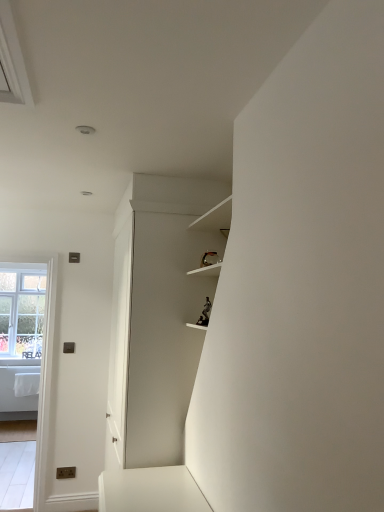
This screenshot has height=512, width=384. I want to click on clear glass window at left, so click(22, 310).

Considering the positions of objects white matte cabinet at center and clear glass window at left in the image provided, who is more to the right, white matte cabinet at center or clear glass window at left?

white matte cabinet at center.

From the image's perspective, is white matte cabinet at center positioned above or below clear glass window at left?

Based on their image positions, white matte cabinet at center is located above clear glass window at left.

Is white matte cabinet at center taller or shorter than clear glass window at left?

Considering their sizes, white matte cabinet at center has more height than clear glass window at left.

Between white matte cabinet at center and clear glass window at left, which one is positioned in front?

white matte cabinet at center.

Where is `glass door that is in front of the clear glass window at left`? The height and width of the screenshot is (512, 384). glass door that is in front of the clear glass window at left is located at coordinates (43, 370).

How many degrees apart are the facing directions of clear glass window at left and clear glass window at left?

The facing directions of clear glass window at left and clear glass window at left are 0.166 degrees apart.

Would you consider clear glass window at left to be distant from clear glass window at left?

clear glass window at left is positioned a significant distance from clear glass window at left.

Is point (25, 302) closer or farther from the camera than point (51, 298)?

Point (25, 302).

Is point (25, 278) closer or farther from the camera than point (157, 188)?

Point (25, 278) is farther from the camera than point (157, 188).

In the scene shown: Considering the sizes of objects clear glass window at left and white matte cabinet at center in the image provided, who is smaller, clear glass window at left or white matte cabinet at center?

Smaller between the two is clear glass window at left.

How different are the orientations of clear glass window at left and white matte cabinet at center in degrees?

The angular difference between clear glass window at left and white matte cabinet at center is 88 degrees.

Can you confirm if clear glass window at left is positioned to the left of white matte cabinet at center?

Yes.

From the image's perspective, is clear glass window at left located above or below clear glass window at left?

Based on their image positions, clear glass window at left is located beneath clear glass window at left.

Is clear glass window at left outside of clear glass window at left?

Indeed, clear glass window at left is completely outside clear glass window at left.

Considering the sizes of clear glass window at left and clear glass window at left in the image, is clear glass window at left taller or shorter than clear glass window at left?

clear glass window at left is taller than clear glass window at left.

Which is more to the right, clear glass window at left or clear glass window at left?

clear glass window at left.

Can you confirm if clear glass window at left is smaller than white matte cabinet at center?

Yes.

Considering the points (1, 259) and (185, 340), which point is in front, point (1, 259) or point (185, 340)?

The point (185, 340) is in front.

Can you confirm if clear glass window at left is positioned to the right of white matte cabinet at center?

In fact, clear glass window at left is to the left of white matte cabinet at center.

From the picture: Is white matte cabinet at center in front of clear glass window at left?

Yes, white matte cabinet at center is in front of clear glass window at left.

From the image's perspective, which one is positioned lower, white matte cabinet at center or clear glass window at left?

clear glass window at left, from the image's perspective.

Can you confirm if white matte cabinet at center is positioned to the left of clear glass window at left?

Incorrect, white matte cabinet at center is not on the left side of clear glass window at left.

Identify the location of dresser lying above the clear glass window at left (from the image's perspective). (157, 316).

Image resolution: width=384 pixels, height=512 pixels. Identify the location of glass door that is in front of the clear glass window at left. (43, 370).

From the picture: Estimate the real-world distances between objects in this image. Which object is further from clear glass window at left, clear glass window at left or white matte cabinet at center?

The object further to clear glass window at left is white matte cabinet at center.

Which object lies further to the anchor point white matte cabinet at center, clear glass window at left or clear glass window at left?

clear glass window at left lies further to white matte cabinet at center than the other object.

When comparing their distances from clear glass window at left, does white matte cabinet at center or clear glass window at left seem further?

Based on the image, white matte cabinet at center appears to be further to clear glass window at left.

From the image, which object appears to be nearer to clear glass window at left, clear glass window at left or white matte cabinet at center?

Among the two, white matte cabinet at center is located nearer to clear glass window at left.

Considering their positions, is white matte cabinet at center positioned closer to clear glass window at left than clear glass window at left?

white matte cabinet at center lies closer to clear glass window at left than the other object.

When comparing their distances from white matte cabinet at center, does clear glass window at left or clear glass window at left seem closer?

Based on the image, clear glass window at left appears to be nearer to white matte cabinet at center.

You are a GUI agent. You are given a task and a screenshot of the screen. Output one action in this format:
    pyautogui.click(x=<x>, y=<y>)
    Task: Click on the glass door between white matte cabinet at center and clear glass window at left in the front-back direction
    The image size is (384, 512).
    Given the screenshot: What is the action you would take?
    pyautogui.click(x=43, y=370)